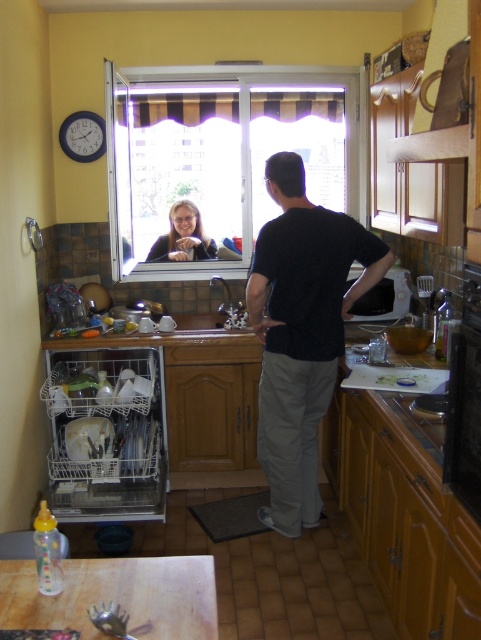
You are a parent trying to locate your child who is hiding behind either the black cotton shirt at center or the matte black hair at upper center. Based on their heights, which object is more likely to hide the child completely?

The black cotton shirt at center is taller than the matte black hair at upper center, so the child would be more completely hidden behind the black cotton shirt at center.

You are a parent looking for a place to put a baby bottle. You see the clear glass window at center and the clear plastic dishwasher at lower left. Which object is closer to you, and can you place the baby bottle on it?

The clear glass window at center is in front of the clear plastic dishwasher at lower left, so the window is closer. However, the window is likely not a suitable surface for placing the baby bottle as it is a window. The dishwasher might be open, but it contains dishes and bottles already. Consider using the wooden table instead which is mentioned in the scene description as having a baby bottle already present.

Based on the photo, you are a parent looking for a place to store a baby bottle. You see the clear glass window at center and the clear plastic dishwasher at lower left. Which object is above the other?

The clear glass window at center is located above the clear plastic dishwasher at lower left.